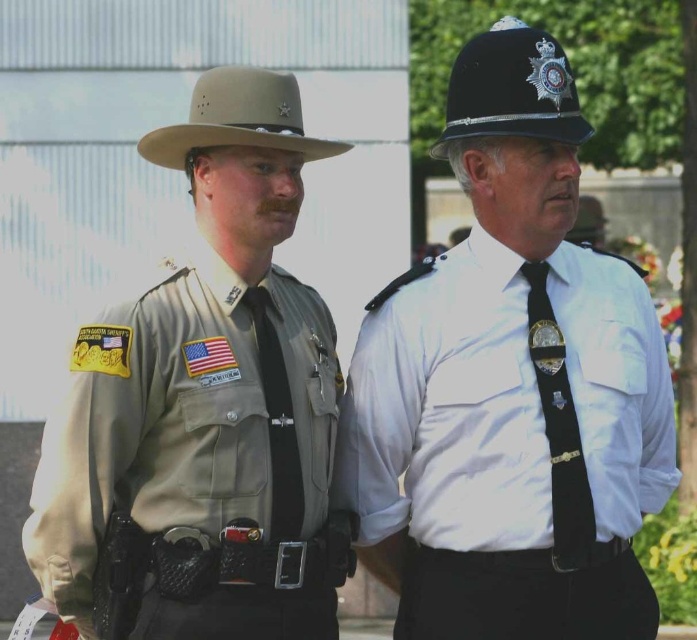
This screenshot has height=640, width=697. I want to click on black matte helmet at upper center, so click(512, 90).

Between black matte helmet at upper center and tan felt cowboy hat at upper left, which one appears on the left side from the viewer's perspective?

tan felt cowboy hat at upper left

Is point (475, 76) less distant than point (256, 109)?

No, it is behind (256, 109).

Identify the location of black matte helmet at upper center. The height and width of the screenshot is (640, 697). (512, 90).

Can you confirm if white glossy shirt at center is positioned above tan felt cowboy hat at upper left?

Incorrect, white glossy shirt at center is not positioned above tan felt cowboy hat at upper left.

Find the location of a particular element. white glossy shirt at center is located at coordinates (510, 387).

Between point (441, 262) and point (256, 570), which one is positioned in front?

Point (256, 570) is in front.

Which is behind, point (482, 282) or point (289, 273)?

The point (289, 273) is behind.

Is point (516, 451) positioned after point (247, 129)?

Yes, it is behind point (247, 129).

Where is `white glossy shirt at center`? white glossy shirt at center is located at coordinates (510, 387).